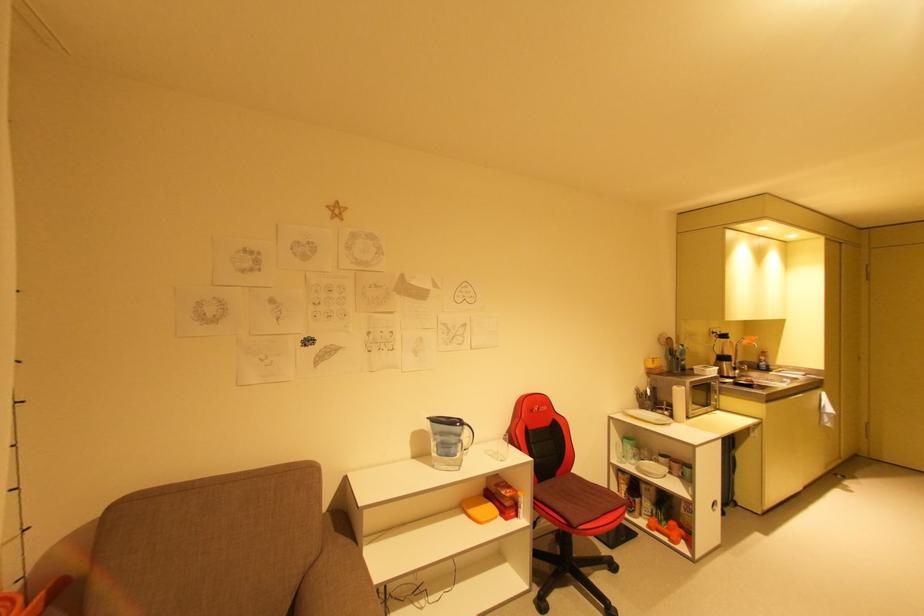
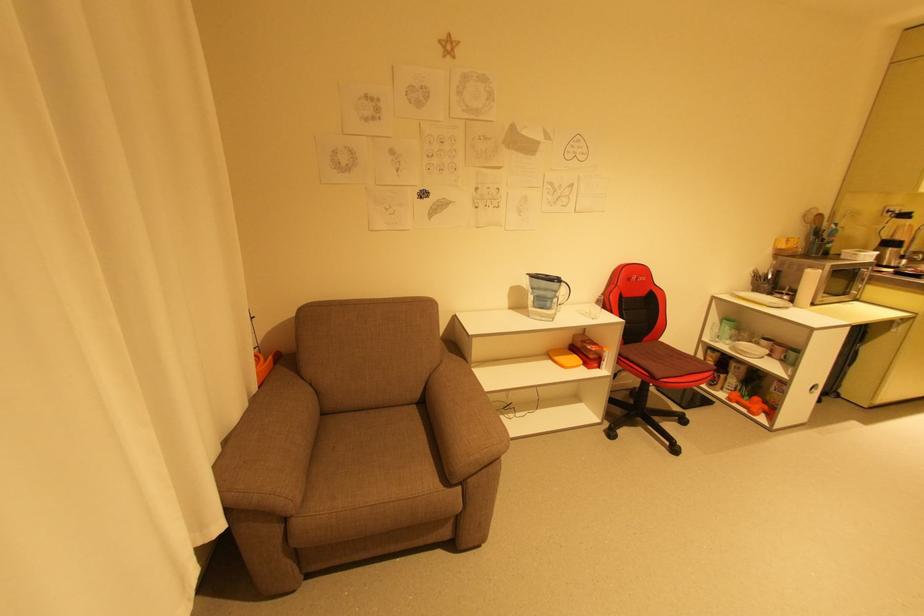
Question: How did the camera likely rotate?

Choices:
 (A) Left
 (B) Right
 (C) Up
 (D) Down

Answer: (D)